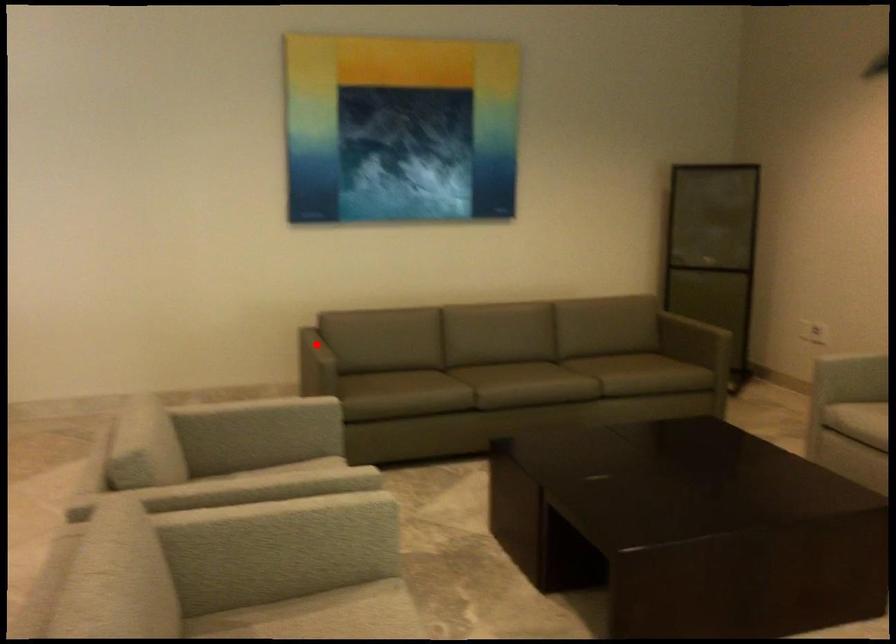
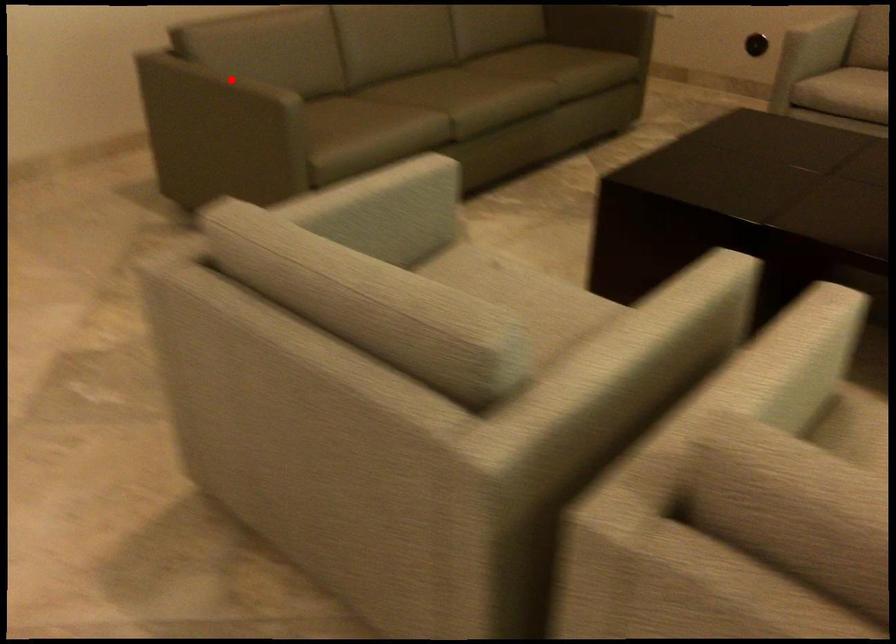
I am providing you with two images of the same scene from different viewpoints. A red point is marked on the first image and another point is marked on the second image. Are the points marked in image1 and image2 representing the same 3D position?

Yes